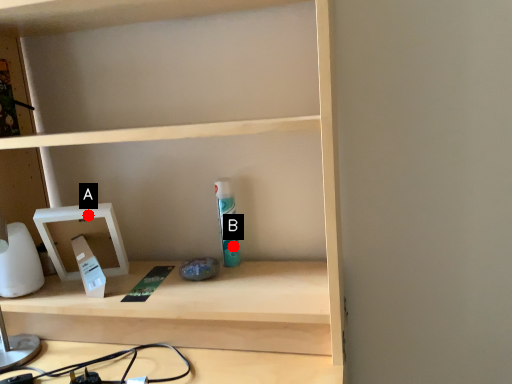
Question: Two points are circled on the image, labeled by A and B beside each circle. Which point is closer to the camera?

Choices:
 (A) A is closer
 (B) B is closer

Answer: (A)